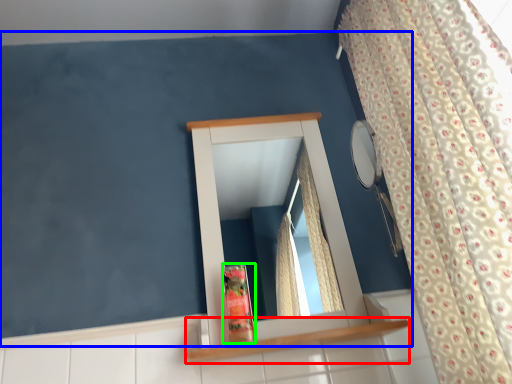
Question: Based on their relative distances, which object is nearer to shelf (highlighted by a red box)? Choose from backdrop (highlighted by a blue box) and toiletry (highlighted by a green box).

Choices:
 (A) backdrop
 (B) toiletry

Answer: (B)